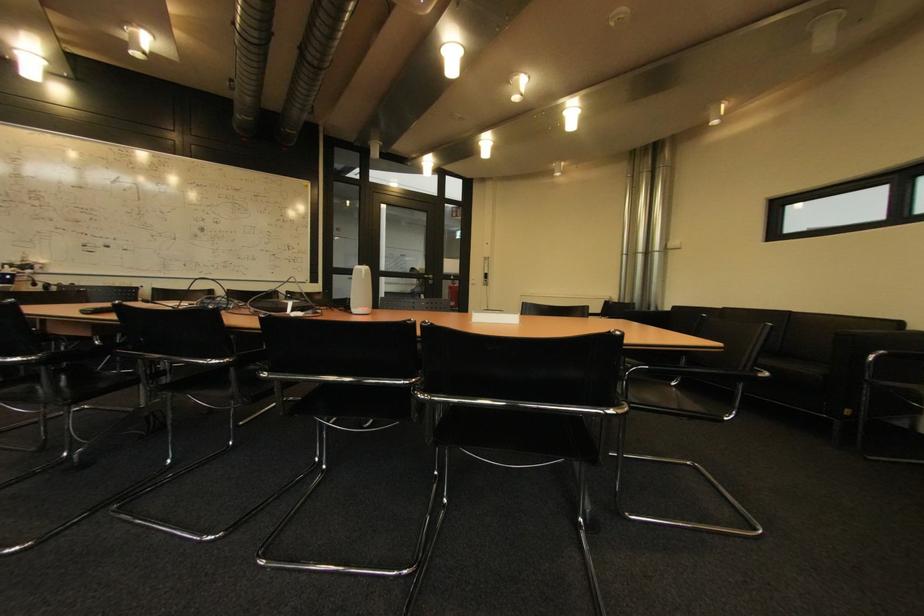
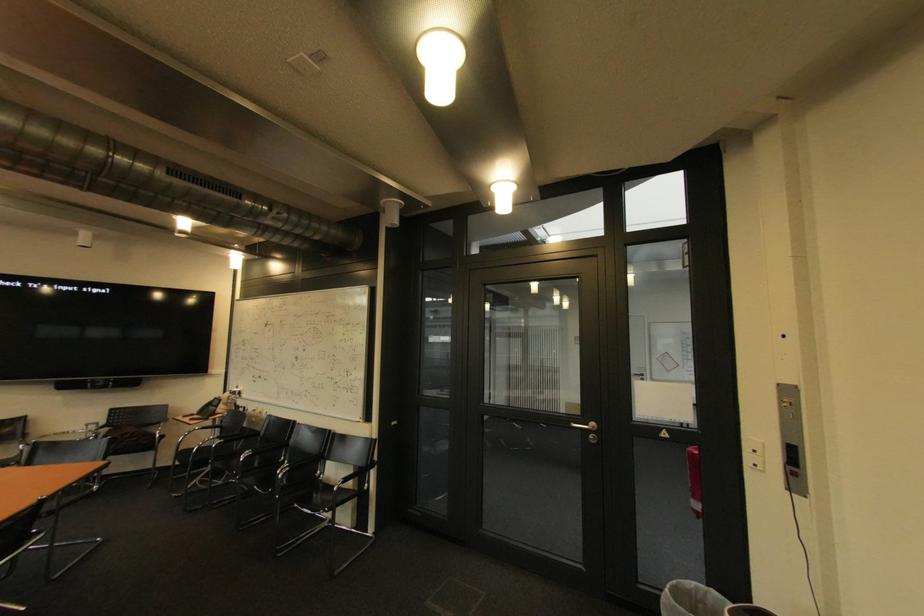
Where in the second image is the point corresponding to (436,278) from the first image?

(596, 426)